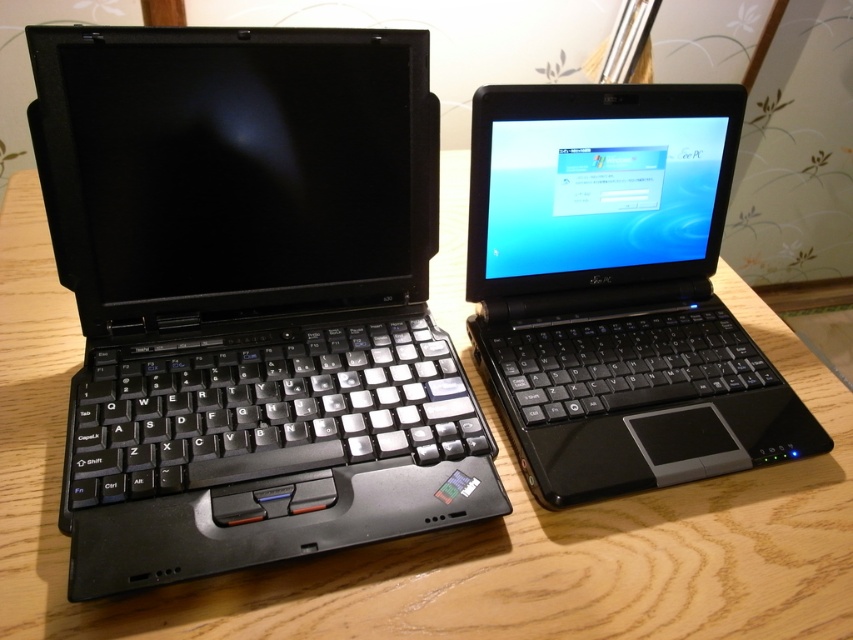
You need to place a rectangular box that is 1.2 meters long on the wooden table at center. Considering the black plastic laptop at center is already on the table, will the box fit on the table without overlapping the laptop?

The wooden table at center is larger in size than the black plastic laptop at center. Since the table is bigger, there should be enough space to place the 1.2 meter long box without overlapping the laptop, provided the table has sufficient length in the direction you place the box.

You are trying to place a 10 cm tall paperweight on the wooden table at center. The black plastic laptop at center is currently on the table. Will the paperweight fit on the table without being under the laptop?

The wooden table at center is taller than the black plastic laptop at center, so the paperweight can be placed on the table at a height that accommodates its 10 cm height without interference from the laptop.

You are taking a photo of two laptops on a desk. The first point you focus on is point (259,49) and the second point is point (526,506). Which point will appear larger in your photo?

Point (259,49) will appear larger in the photo because it is closer to the camera than point (526,506).